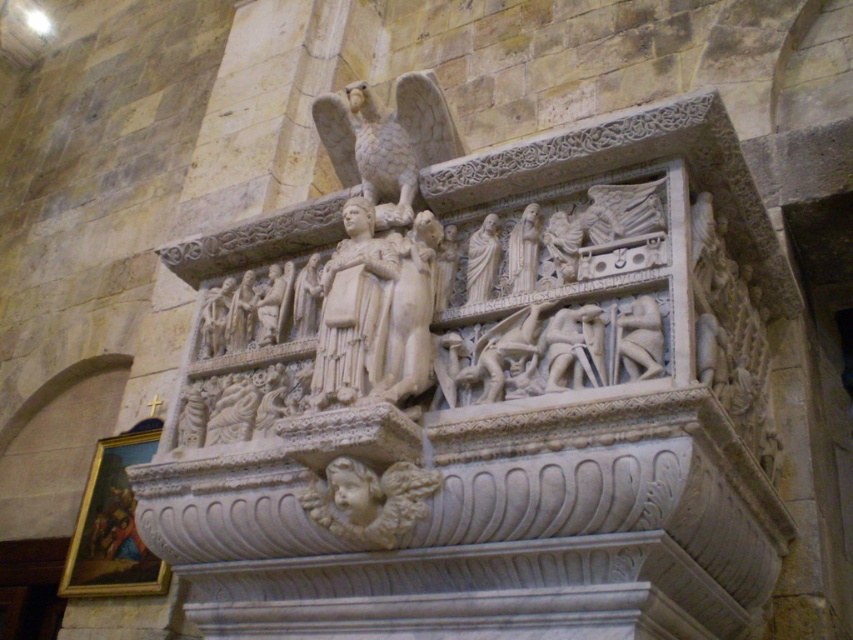
Question: Does white marble eagle at upper center have a greater width compared to white marble statue at center?

Choices:
 (A) no
 (B) yes

Answer: (B)

Question: Which of the following is the closest to the observer?

Choices:
 (A) (434, 96)
 (B) (334, 305)

Answer: (B)

Question: Does white marble eagle at upper center have a smaller size compared to white marble statue at center?

Choices:
 (A) no
 (B) yes

Answer: (A)

Question: Among these points, which one is farthest from the camera?

Choices:
 (A) pyautogui.click(x=372, y=129)
 (B) pyautogui.click(x=337, y=294)

Answer: (A)

Question: Which point appears closest to the camera in this image?

Choices:
 (A) (440, 93)
 (B) (345, 232)

Answer: (A)

Question: Is white marble eagle at upper center positioned before white marble statue at center?

Choices:
 (A) yes
 (B) no

Answer: (B)